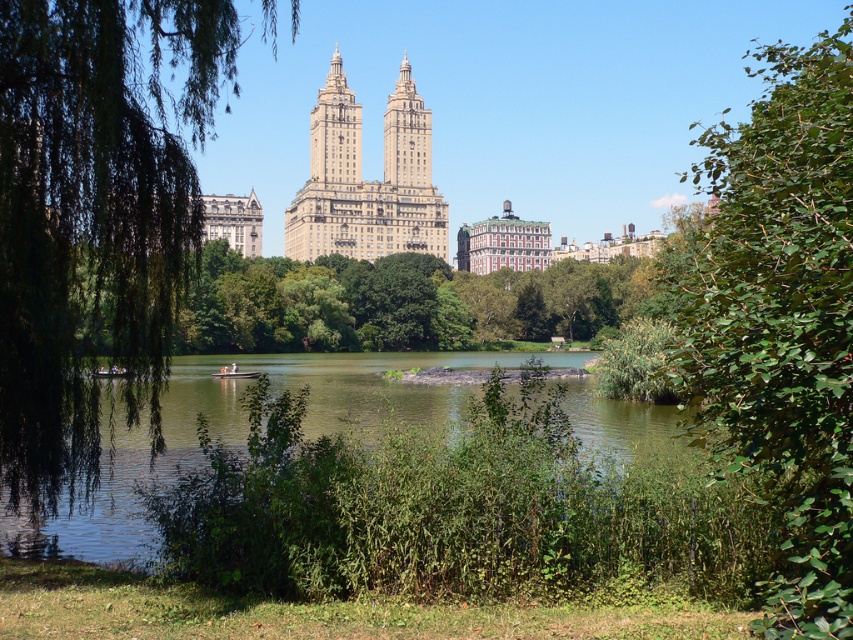
Question: Based on their relative distances, which object is nearer to the green leafy tree at center?

Choices:
 (A) green leafy bush at center
 (B) green leafy tree at left
 (C) wooden boat at center
 (D) beige stone building at center

Answer: (D)

Question: Is green grassy river at center positioned behind beige stone building at center?

Choices:
 (A) no
 (B) yes

Answer: (A)

Question: Does green leafy tree at center have a lesser width compared to beige stone building at center?

Choices:
 (A) no
 (B) yes

Answer: (A)

Question: Is green leafy tree at left positioned at the back of green grassy river at center?

Choices:
 (A) no
 (B) yes

Answer: (A)

Question: Which object is closer to the camera taking this photo?

Choices:
 (A) green leafy tree at center
 (B) wooden boat at center
 (C) beige stone building at center

Answer: (A)

Question: Which is nearer to the green leafy bush at center?

Choices:
 (A) beige stone building at center
 (B) green grassy river at center
 (C) green leafy tree at center
 (D) green leafy tree at left

Answer: (B)